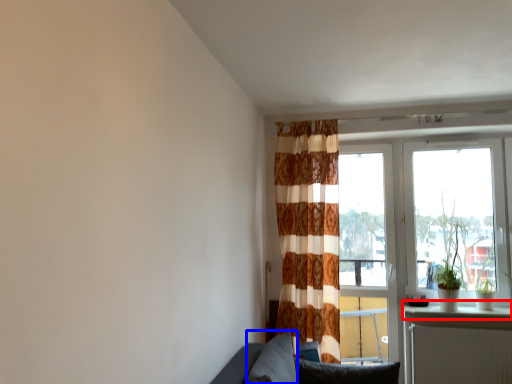
Question: Which object is further to the camera taking this photo, window sill (highlighted by a red box) or pillow (highlighted by a blue box)?

Choices:
 (A) window sill
 (B) pillow

Answer: (A)